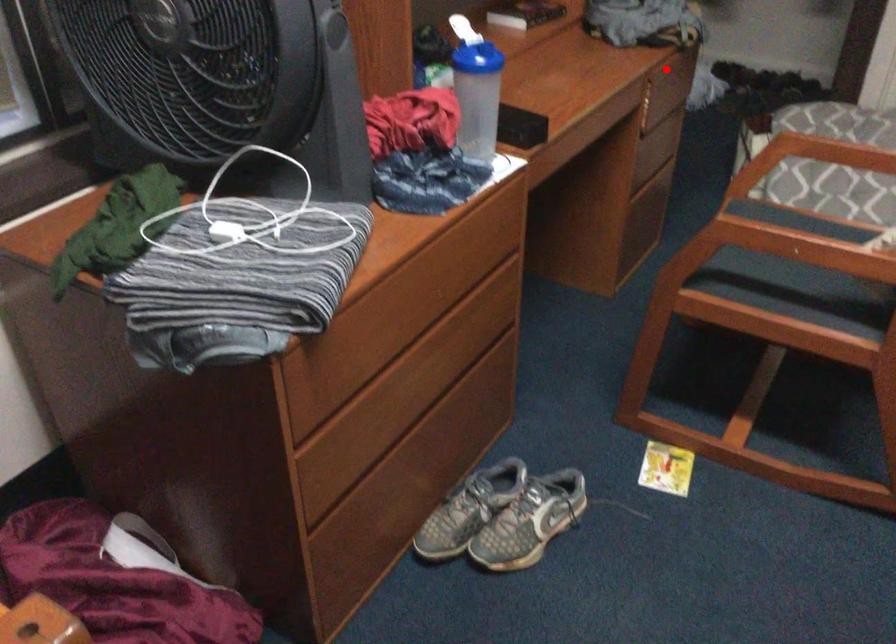
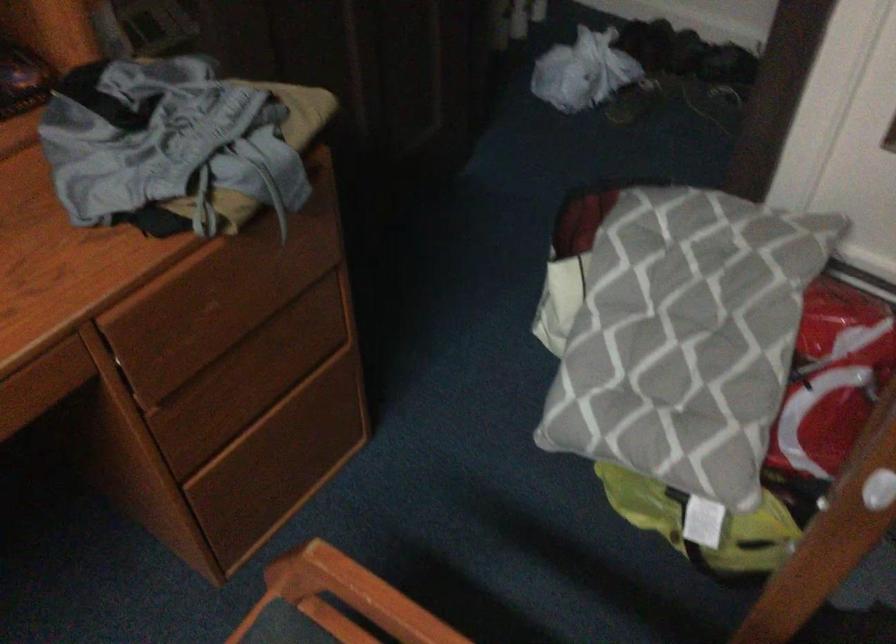
Question: I am providing you with two images of the same scene from different viewpoints. Given a red point in image1, look at the same physical point in image2. Is it:

Choices:
 (A) Closer to the viewpoint
 (B) Farther from the viewpoint

Answer: (A)